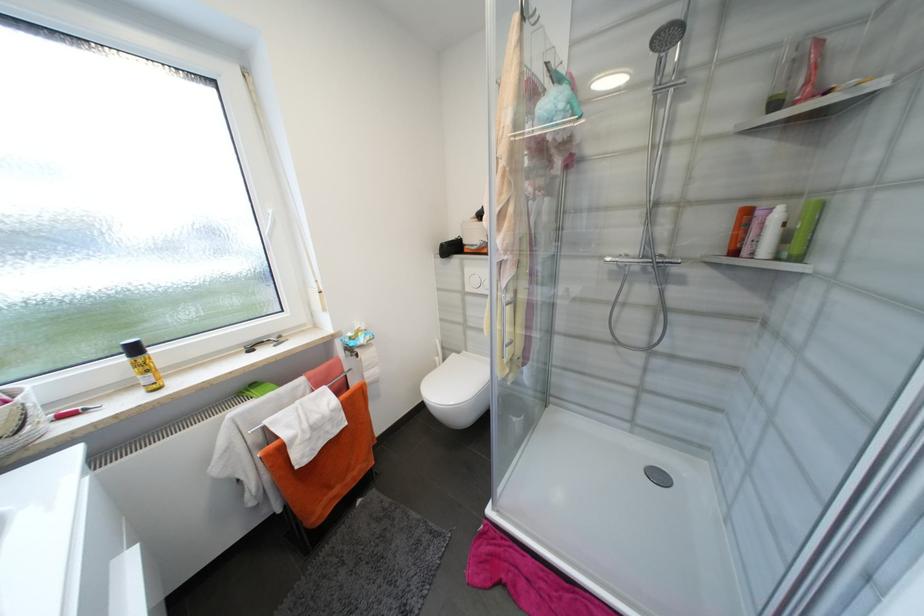
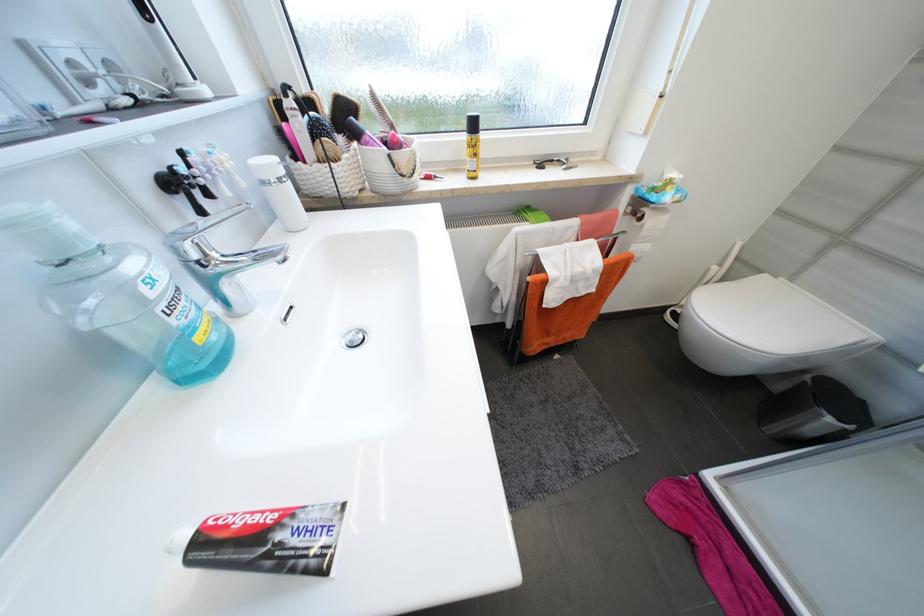
The point at (152, 381) is marked in the first image. Where is the corresponding point in the second image?

(477, 166)